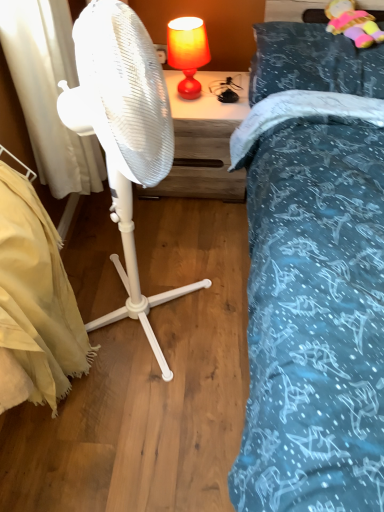
Locate an element on the screen. This screenshot has width=384, height=512. vacant region to the right of beige fabric mattress at lower left is located at coordinates (164, 412).